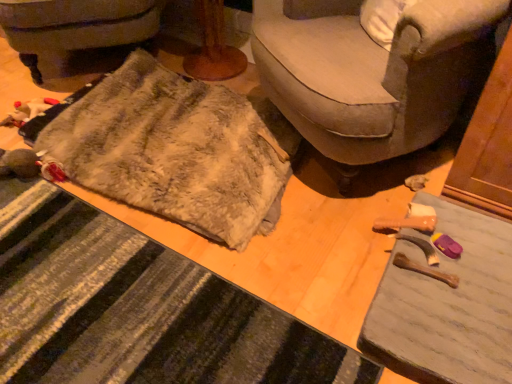
I want to click on fuzzy fabric blanket at lower left, so click(x=77, y=35).

Is wooden table at lower right positioned with its back to fuzzy fabric doormat at lower left?

wooden table at lower right does not have its back to fuzzy fabric doormat at lower left.

Which of these two, wooden table at lower right or fuzzy fabric doormat at lower left, is smaller?

With smaller size is wooden table at lower right.

From the image's perspective, is wooden table at lower right over fuzzy fabric doormat at lower left?

Indeed, from the image's perspective, wooden table at lower right is shown above fuzzy fabric doormat at lower left.

Is wooden table at lower right inside or outside of fuzzy fabric doormat at lower left?

wooden table at lower right is not enclosed by fuzzy fabric doormat at lower left.

Are fuzzy fabric doormat at lower left and fuzzy beige blanket at lower left making contact?

No, fuzzy fabric doormat at lower left is not beside fuzzy beige blanket at lower left.

You are a GUI agent. You are given a task and a screenshot of the screen. Output one action in this format:
    pyautogui.click(x=<x>, y=<y>)
    Task: Click on the doormat below the fuzzy beige blanket at lower left (from the image's perspective)
    The image size is (512, 384).
    Given the screenshot: What is the action you would take?
    pyautogui.click(x=139, y=310)

Which of these two, fuzzy fabric doormat at lower left or fuzzy beige blanket at lower left, stands shorter?

With less height is fuzzy fabric doormat at lower left.

Looking at their sizes, would you say fuzzy fabric doormat at lower left is wider or thinner than fuzzy beige blanket at lower left?

Clearly, fuzzy fabric doormat at lower left has less width compared to fuzzy beige blanket at lower left.

Which is in front, fuzzy fabric blanket at lower left or wooden table at lower right?

wooden table at lower right is in front.

In terms of size, does fuzzy fabric blanket at lower left appear bigger or smaller than wooden table at lower right?

Considering their sizes, fuzzy fabric blanket at lower left takes up more space than wooden table at lower right.

Considering the relative sizes of fuzzy fabric blanket at lower left and wooden table at lower right in the image provided, is fuzzy fabric blanket at lower left thinner than wooden table at lower right?

No, fuzzy fabric blanket at lower left is not thinner than wooden table at lower right.

Consider the image. Is fuzzy fabric blanket at lower left completely or partially outside of wooden table at lower right?

fuzzy fabric blanket at lower left is positioned outside wooden table at lower right.

Considering the sizes of objects fuzzy fabric blanket at lower left and fuzzy beige blanket at lower left in the image provided, who is taller, fuzzy fabric blanket at lower left or fuzzy beige blanket at lower left?

fuzzy fabric blanket at lower left.

Which of these two, fuzzy fabric blanket at lower left or fuzzy beige blanket at lower left, is thinner?

With smaller width is fuzzy fabric blanket at lower left.

Is fuzzy fabric blanket at lower left positioned far away from fuzzy beige blanket at lower left?

No.

Which is in front, fuzzy fabric blanket at lower left or fuzzy beige blanket at lower left?

fuzzy beige blanket at lower left is more forward.

Considering the relative positions of fuzzy beige blanket at lower left and soft beige fabric couch at center in the image provided, is fuzzy beige blanket at lower left to the left of soft beige fabric couch at center from the viewer's perspective?

Yes, fuzzy beige blanket at lower left is to the left of soft beige fabric couch at center.

From the image's perspective, which is below, fuzzy beige blanket at lower left or soft beige fabric couch at center?

fuzzy beige blanket at lower left is shown below in the image.

Considering the relative sizes of fuzzy beige blanket at lower left and soft beige fabric couch at center in the image provided, is fuzzy beige blanket at lower left smaller than soft beige fabric couch at center?

Correct, fuzzy beige blanket at lower left occupies less space than soft beige fabric couch at center.

Is fuzzy beige blanket at lower left next to soft beige fabric couch at center?

No, fuzzy beige blanket at lower left is not touching soft beige fabric couch at center.

Is fuzzy fabric blanket at lower left completely or partially inside fuzzy fabric doormat at lower left?

Definitely not — fuzzy fabric blanket at lower left is not inside fuzzy fabric doormat at lower left.

Is fuzzy fabric doormat at lower left not close to fuzzy fabric blanket at lower left?

fuzzy fabric doormat at lower left is positioned a significant distance from fuzzy fabric blanket at lower left.

In the image, there is a fuzzy fabric blanket at lower left. In order to click on doormat below it (from the image's perspective) in this screenshot , I will do `click(139, 310)`.

Looking at this image, which is more to the right, fuzzy fabric doormat at lower left or fuzzy fabric blanket at lower left?

fuzzy fabric doormat at lower left is more to the right.

From the image's perspective, is fuzzy fabric doormat at lower left above or below wooden table at lower right?

fuzzy fabric doormat at lower left is below wooden table at lower right.

From a real-world perspective, relative to wooden table at lower right, is fuzzy fabric doormat at lower left vertically above or below?

Clearly, from a real-world perspective, fuzzy fabric doormat at lower left is below wooden table at lower right.

Which object is thinner, fuzzy fabric doormat at lower left or wooden table at lower right?

fuzzy fabric doormat at lower left is thinner.

Locate an element on the screen. table lying behind the fuzzy fabric doormat at lower left is located at coordinates (446, 304).

You are a GUI agent. You are given a task and a screenshot of the screen. Output one action in this format:
    pyautogui.click(x=<x>, y=<y>)
    Task: Click on the doormat in front of the wooden table at lower right
    The width and height of the screenshot is (512, 384).
    Given the screenshot: What is the action you would take?
    pyautogui.click(x=139, y=310)

The width and height of the screenshot is (512, 384). In order to click on blanket lying above the fuzzy fabric doormat at lower left (from the image's perspective) in this screenshot , I will do `click(177, 150)`.

When comparing their distances from wooden table at lower right, does soft beige fabric couch at center or fuzzy beige blanket at lower left seem further?

Among the two, fuzzy beige blanket at lower left is located further to wooden table at lower right.

Considering their positions, is wooden table at lower right positioned closer to soft beige fabric couch at center than fuzzy fabric doormat at lower left?

wooden table at lower right is positioned closer to the anchor soft beige fabric couch at center.

Considering their positions, is soft beige fabric couch at center positioned closer to fuzzy fabric blanket at lower left than fuzzy fabric doormat at lower left?

soft beige fabric couch at center.

When comparing their distances from soft beige fabric couch at center, does fuzzy fabric doormat at lower left or fuzzy beige blanket at lower left seem further?

fuzzy fabric doormat at lower left lies further to soft beige fabric couch at center than the other object.

Estimate the real-world distances between objects in this image. Which object is closer to fuzzy beige blanket at lower left, fuzzy fabric blanket at lower left or fuzzy fabric doormat at lower left?

fuzzy fabric doormat at lower left is positioned closer to the anchor fuzzy beige blanket at lower left.

Estimate the real-world distances between objects in this image. Which object is further from wooden table at lower right, fuzzy beige blanket at lower left or soft beige fabric couch at center?

Based on the image, fuzzy beige blanket at lower left appears to be further to wooden table at lower right.

Estimate the real-world distances between objects in this image. Which object is closer to fuzzy fabric blanket at lower left, wooden table at lower right or fuzzy fabric doormat at lower left?

Among the two, fuzzy fabric doormat at lower left is located nearer to fuzzy fabric blanket at lower left.

Looking at the image, which one is located closer to soft beige fabric couch at center, fuzzy fabric doormat at lower left or fuzzy fabric blanket at lower left?

fuzzy fabric doormat at lower left is closer to soft beige fabric couch at center.

Image resolution: width=512 pixels, height=384 pixels. What are the coordinates of `studio couch located between fuzzy fabric blanket at lower left and wooden table at lower right in the left-right direction` in the screenshot? It's located at (371, 72).

In order to click on blanket between fuzzy fabric doormat at lower left and wooden table at lower right in this screenshot , I will do `click(177, 150)`.

Identify the location of studio couch between fuzzy fabric doormat at lower left and wooden table at lower right in the horizontal direction. Image resolution: width=512 pixels, height=384 pixels. (371, 72).

Identify the location of blanket between fuzzy fabric blanket at lower left and fuzzy fabric doormat at lower left in the up-down direction. The image size is (512, 384). click(x=177, y=150).